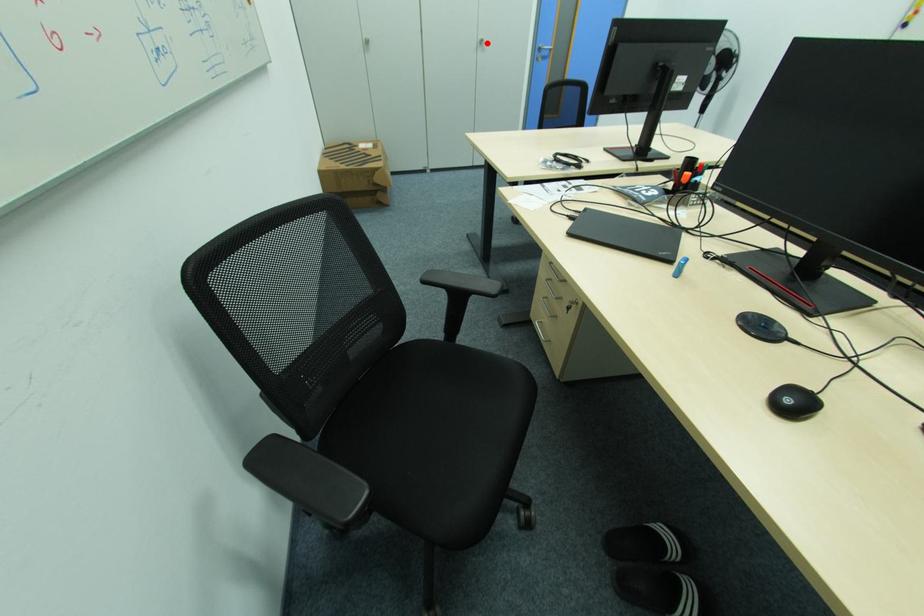
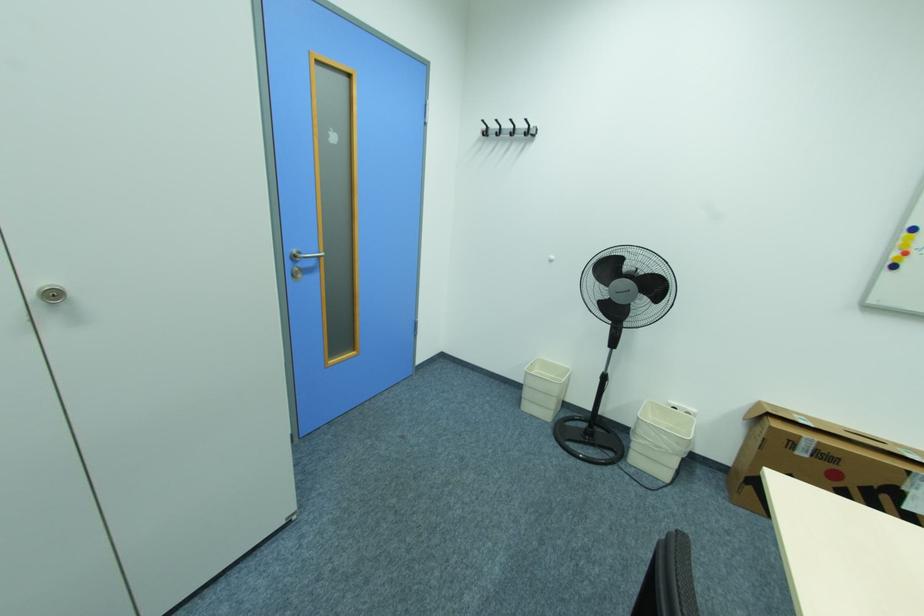
Find the pixel in the second image that matches the highlighted location in the first image.

(64, 294)